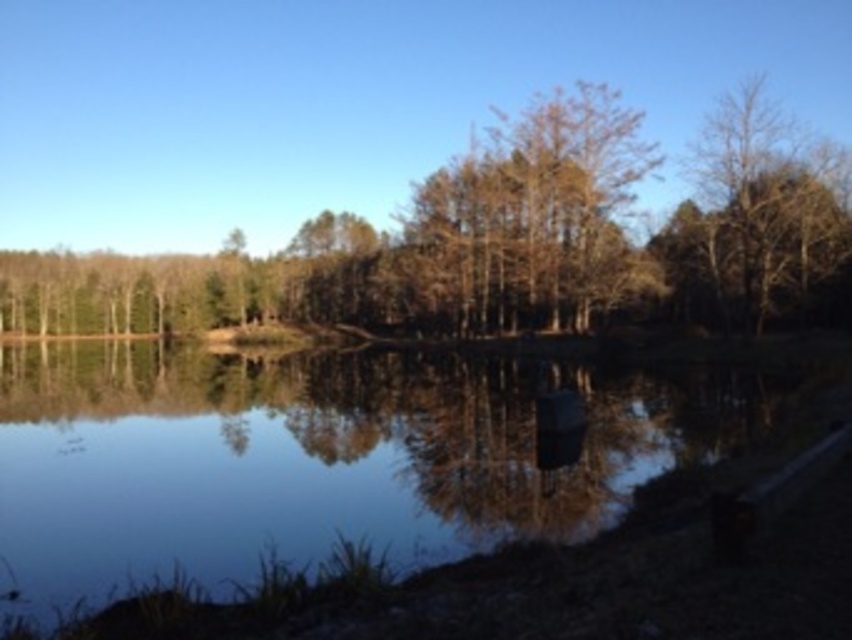
You are standing at the edge of the lake and want to take a photo that includes both the smooth reflective water at center and the brown leafy tree at center. Which object will appear larger in the photo?

The brown leafy tree at center will appear larger in the photo because it is taller than the smooth reflective water at center.